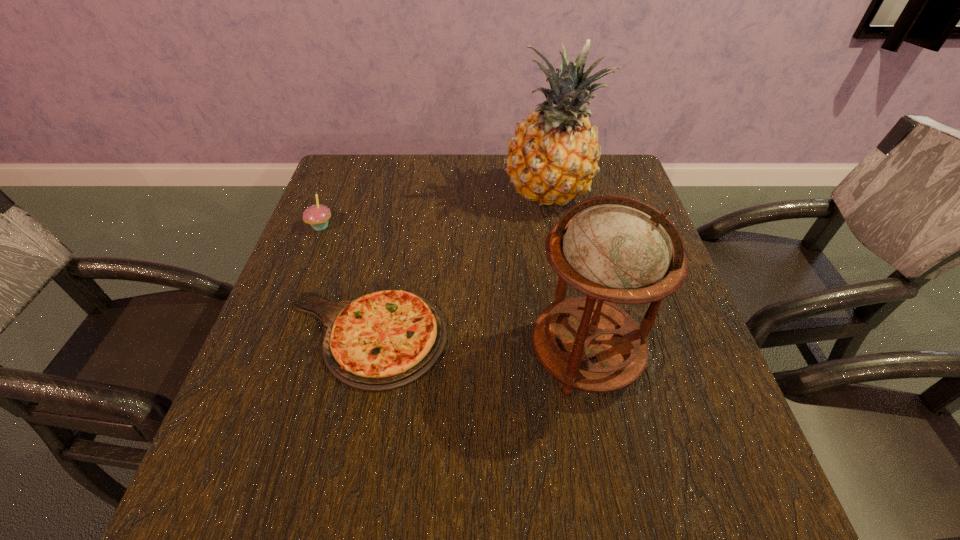
The image size is (960, 540). What are the coordinates of `pineapple` in the screenshot? It's located at (552, 158).

I want to click on globe, so click(x=616, y=249).

At what (x,y) coordinates should I click in order to perform the action: click on cupcake. Please return your answer as a coordinate pair (x, y). Looking at the image, I should click on (317, 216).

Find the location of a particular element. the shortest object is located at coordinates (384, 340).

The height and width of the screenshot is (540, 960). Find the location of `vacant space located on the back of the pineapple`. vacant space located on the back of the pineapple is located at coordinates (540, 155).

Find the location of `free space located on the surface of the globe`. free space located on the surface of the globe is located at coordinates (612, 488).

At what (x,y) coordinates should I click in order to perform the action: click on vacant space located 0.320m on the right of the third tallest object. Please return your answer as a coordinate pair (x, y). Looking at the image, I should click on (458, 226).

Find the location of a particular element. This screenshot has height=540, width=960. vacant space located 0.320m on the right of the pizza is located at coordinates (606, 338).

Identify the location of object at the far edge. This screenshot has width=960, height=540. (552, 158).

Where is `cupcake at the left edge`? cupcake at the left edge is located at coordinates (317, 216).